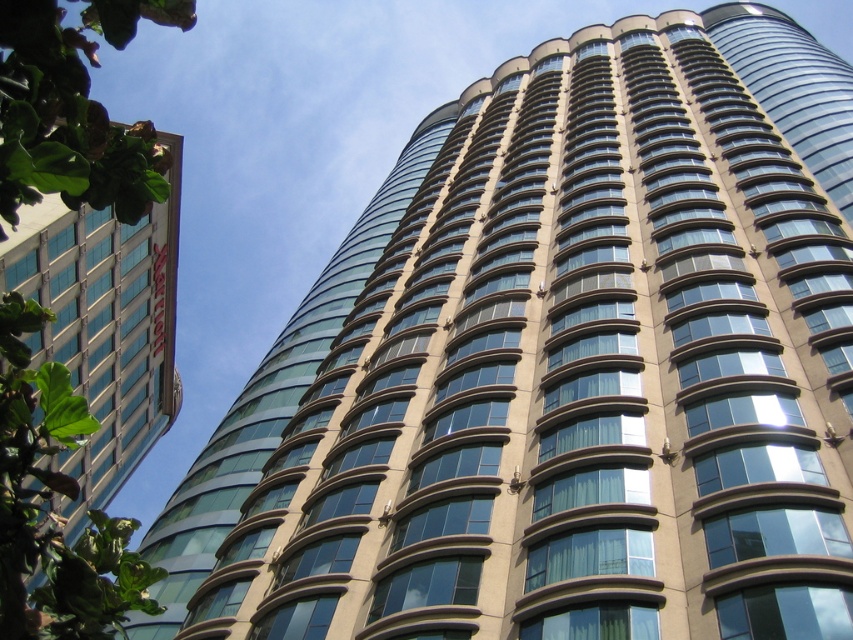
Question: Does glassy blue windows at upper left have a larger size compared to glassy tan tower at upper right?

Choices:
 (A) yes
 (B) no

Answer: (B)

Question: Is glassy blue windows at upper left bigger than glassy tan tower at upper right?

Choices:
 (A) no
 (B) yes

Answer: (A)

Question: Is glassy blue windows at upper left positioned before glassy tan tower at upper right?

Choices:
 (A) no
 (B) yes

Answer: (B)

Question: Which of the following is the closest to the observer?

Choices:
 (A) glassy blue windows at upper left
 (B) glassy tan tower at upper right

Answer: (A)

Question: Which point appears farthest from the camera in this image?

Choices:
 (A) (106, 426)
 (B) (732, 12)

Answer: (B)